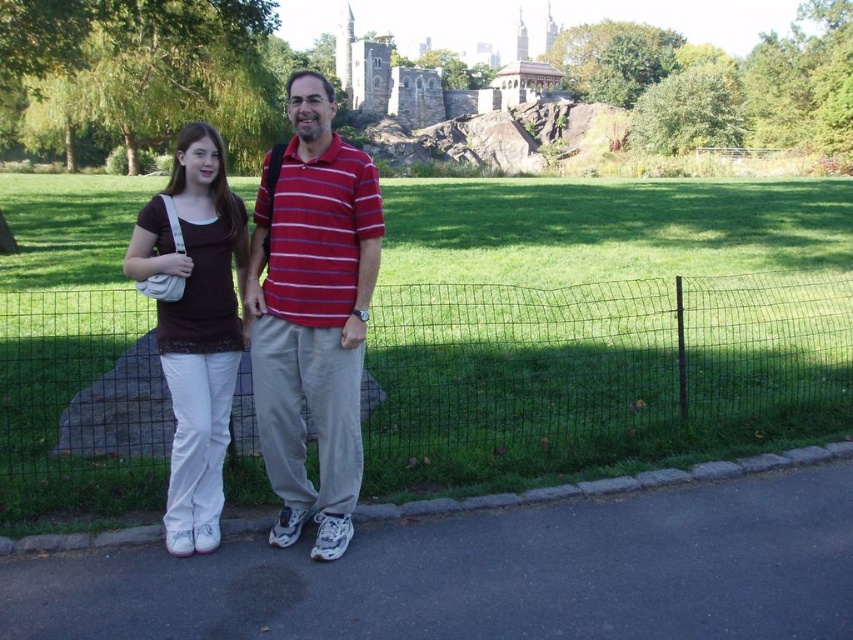
Which is more to the right, wire mesh fence at center or matte red striped polo shirt at center?

From the viewer's perspective, wire mesh fence at center appears more on the right side.

Is point (378, 392) positioned in front of point (289, 465)?

No, it is behind (289, 465).

Is point (781, 356) closer to viewer compared to point (262, 225)?

No.

Locate an element on the screen. Image resolution: width=853 pixels, height=640 pixels. wire mesh fence at center is located at coordinates (598, 372).

Image resolution: width=853 pixels, height=640 pixels. What do you see at coordinates (598, 372) in the screenshot?
I see `wire mesh fence at center` at bounding box center [598, 372].

Is wire mesh fence at center below matte white pants at center?

No, wire mesh fence at center is not below matte white pants at center.

Does point (599, 449) come farther from viewer compared to point (183, 497)?

Yes, point (599, 449) is farther from viewer.

The height and width of the screenshot is (640, 853). I want to click on wire mesh fence at center, so click(598, 372).

From the picture: Who is higher up, matte red striped polo shirt at center or matte white pants at center?

matte red striped polo shirt at center

Between matte red striped polo shirt at center and matte white pants at center, which one appears on the right side from the viewer's perspective?

Positioned to the right is matte red striped polo shirt at center.

Between point (306, 394) and point (199, 195), which one is positioned in front?

Point (306, 394)

The width and height of the screenshot is (853, 640). What are the coordinates of `matte red striped polo shirt at center` in the screenshot? It's located at tap(312, 316).